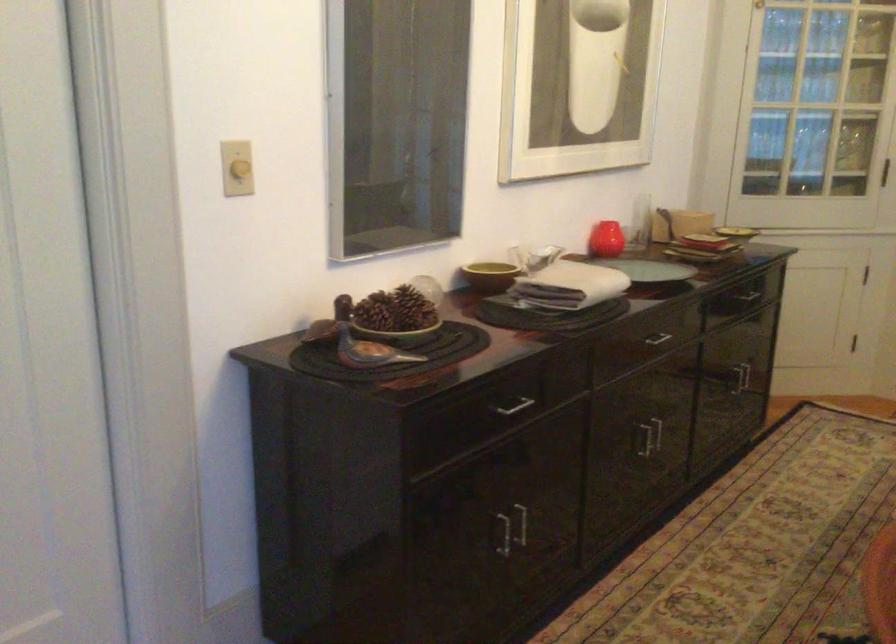
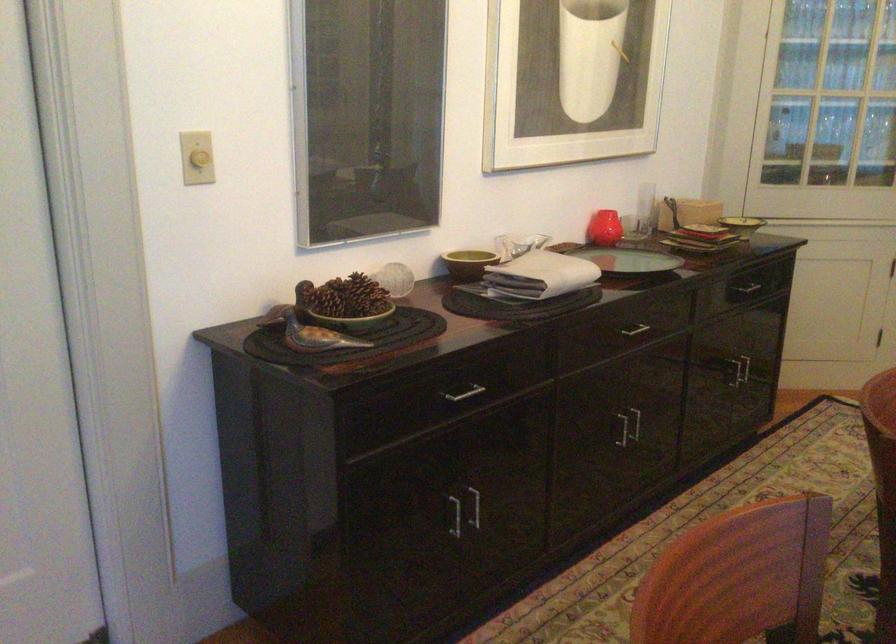
Find the pixel in the second image that matches [513,406] in the first image.

(462, 393)